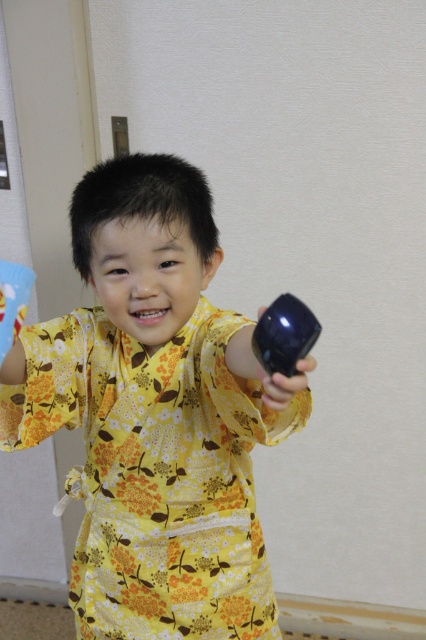
Which is behind, point (85, 237) or point (288, 369)?

Positioned behind is point (85, 237).

I want to click on yellow floral kimono at center, so click(155, 413).